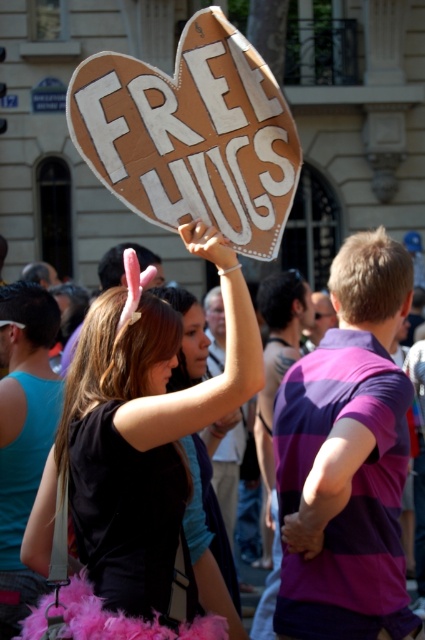
You are an artist trying to sketch the scene. You notice the matte pink feather at center and the matte cardboard sign at upper center. Which object should you draw first if you want to capture the wider object first?

The matte pink feather at center should be drawn first because its width surpasses that of the matte cardboard sign at upper center.